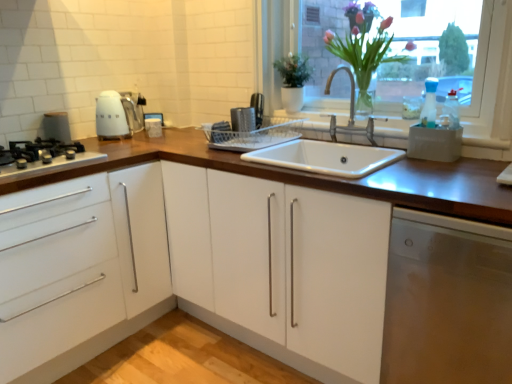
Question: Considering the positions of point (334, 182) and point (234, 122), is point (334, 182) closer or farther from the camera than point (234, 122)?

Choices:
 (A) farther
 (B) closer

Answer: (B)

Question: Is wooden at center taller or shorter than metallic silver dish rack at center, positioned as the 2th appliance in left-to-right order?

Choices:
 (A) short
 (B) tall

Answer: (B)

Question: Which object is positioned farthest from the translucent glass vase at upper right?

Choices:
 (A) matte white kettle at left, the second appliance viewed from the right
 (B) white glossy kettle at upper left
 (C) stainless steel dishwasher at lower right
 (D) white glossy cabinet at left
 (E) black matte gas stove at left

Answer: (A)

Question: Which of these objects is positioned farthest from the black matte gas stove at left?

Choices:
 (A) translucent glass vase at upper right
 (B) white glossy kettle at upper left
 (C) stainless steel dishwasher at lower right
 (D) matte white kettle at left, the second appliance viewed from the right
 (E) wooden at center

Answer: (C)